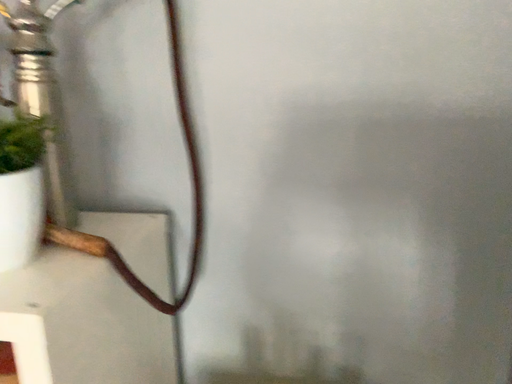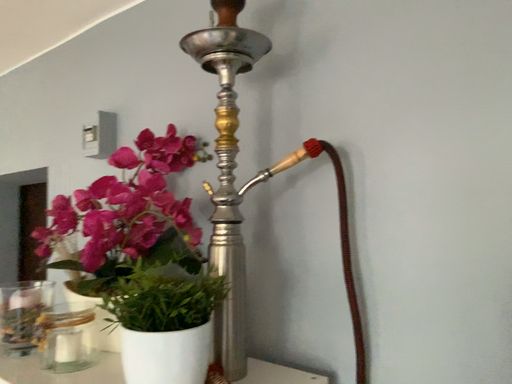
Question: How did the camera likely rotate when shooting the video?

Choices:
 (A) rotated downward
 (B) rotated upward

Answer: (B)